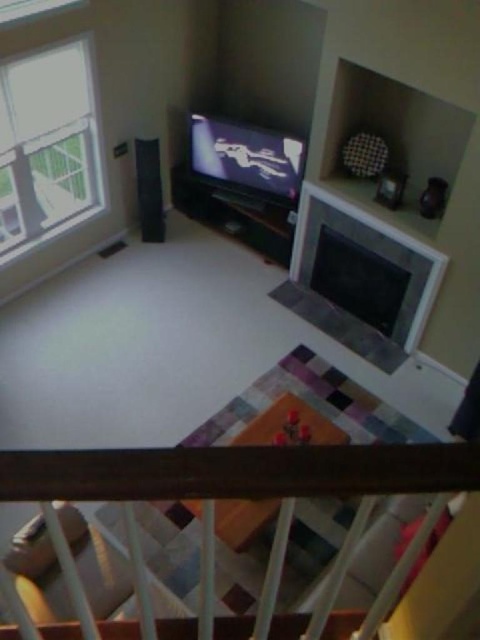
You are standing in the living room and want to look out the clear glass window at upper left while also watching the matte black flat screen tv at center. Can you see both at the same time without moving your head?

The clear glass window at upper left is to the left of matte black flat screen tv at center, so if you are facing the tv, the window would be to your left side. Therefore, you can see both at the same time without moving your head by glancing slightly to the left while facing the tv.

You are standing at the top of the staircase looking down into the living room. You see the brown wooden rail at upper center and the matte black flat screen tv at center. Which object is closer to you from your current viewpoint?

The brown wooden rail at upper center is closer to you because it is in front of the matte black flat screen tv at center from your viewpoint.